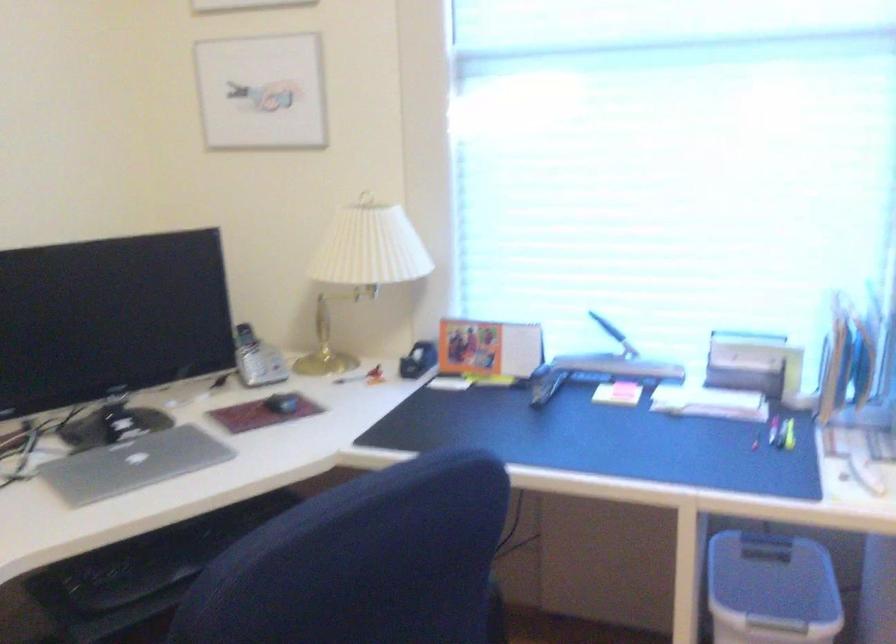
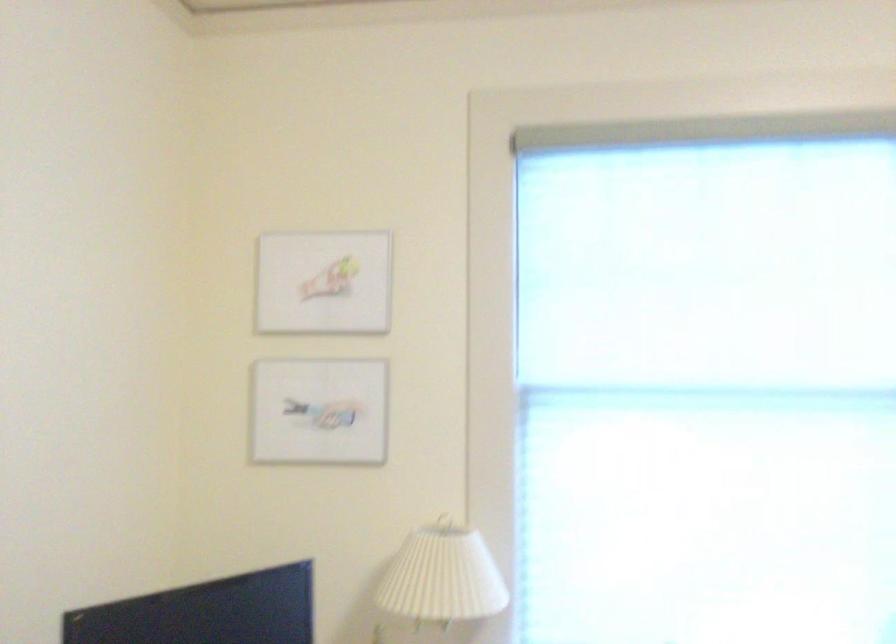
In the second image, find the point that corresponds to (259,91) in the first image.

(319, 412)